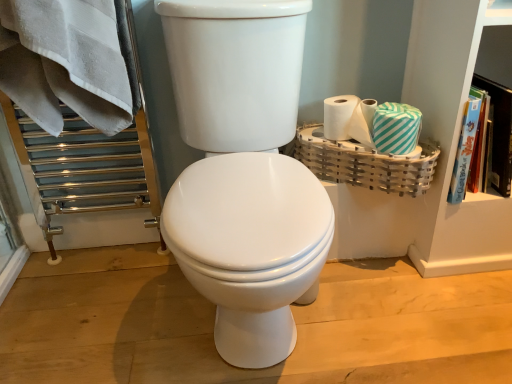
What do you see at coordinates (244, 171) in the screenshot? I see `white glossy toilet at center` at bounding box center [244, 171].

Describe the element at coordinates (470, 147) in the screenshot. The width and height of the screenshot is (512, 384). I see `hardcover book at upper right` at that location.

The height and width of the screenshot is (384, 512). Find the location of `green striped toilet paper at right`. green striped toilet paper at right is located at coordinates (359, 128).

The width and height of the screenshot is (512, 384). Identify the location of teal striped tissue at right. 396,128.

Locate an element on the screen. The width and height of the screenshot is (512, 384). white glossy toilet at center is located at coordinates (244, 171).

Does white glossy toilet at center have a larger size compared to bamboo basket at right?

Yes.

Choose the correct answer: Is white glossy toilet at center inside bamboo basket at right or outside it?

white glossy toilet at center exists outside the volume of bamboo basket at right.

Considering the points (234, 18) and (335, 153), which point is behind, point (234, 18) or point (335, 153)?

The point (335, 153) is more distant.

Considering the positions of objects white glossy toilet at center and bamboo basket at right in the image provided, who is more to the left, white glossy toilet at center or bamboo basket at right?

white glossy toilet at center is more to the left.

Which is farther from the camera, (464, 127) or (338, 167)?

The point (338, 167) is farther.

Where is `book behind the bamboo basket at right`? book behind the bamboo basket at right is located at coordinates (470, 147).

Who is taller, hardcover book at upper right or bamboo basket at right?

hardcover book at upper right.

How different are the orientations of green striped toilet paper at right and white glossy toilet at center in degrees?

The angular difference between green striped toilet paper at right and white glossy toilet at center is 1.43 degrees.

Is point (364, 134) in front of point (252, 73)?

No, it is behind (252, 73).

Visually, is green striped toilet paper at right positioned to the left or to the right of white glossy toilet at center?

Clearly, green striped toilet paper at right is on the right of white glossy toilet at center in the image.

Is the position of green striped toilet paper at right more distant than that of hardcover book at upper right?

Yes, the depth of green striped toilet paper at right is greater than that of hardcover book at upper right.

Can you tell me how much green striped toilet paper at right and hardcover book at upper right differ in facing direction?

The angular difference between green striped toilet paper at right and hardcover book at upper right is 2.66 degrees.

Considering the sizes of objects green striped toilet paper at right and hardcover book at upper right in the image provided, who is bigger, green striped toilet paper at right or hardcover book at upper right?

hardcover book at upper right is bigger.

From the image's perspective, does green striped toilet paper at right appear higher than hardcover book at upper right?

Yes, from the image's perspective, green striped toilet paper at right is above hardcover book at upper right.

From the image's perspective, is green striped toilet paper at right below teal striped tissue at right?

No, from the image's perspective, green striped toilet paper at right is not beneath teal striped tissue at right.

The width and height of the screenshot is (512, 384). In order to click on toilet paper on the left of teal striped tissue at right in this screenshot , I will do `click(359, 128)`.

Who is bigger, green striped toilet paper at right or teal striped tissue at right?

Bigger between the two is teal striped tissue at right.

Is green striped toilet paper at right not close to teal striped tissue at right?

No, green striped toilet paper at right is not far away from teal striped tissue at right.

Considering the points (378, 149) and (338, 145), which point is behind, point (378, 149) or point (338, 145)?

Point (338, 145)

Is teal striped tissue at right far away from bamboo basket at right?

No, there isn't a large distance between teal striped tissue at right and bamboo basket at right.

Considering the sizes of objects teal striped tissue at right and bamboo basket at right in the image provided, who is smaller, teal striped tissue at right or bamboo basket at right?

With smaller size is teal striped tissue at right.

From the image's perspective, between bamboo basket at right and teal striped tissue at right, who is located below?

bamboo basket at right.

From a real-world perspective, is bamboo basket at right positioned over teal striped tissue at right based on gravity?

Incorrect, from a real-world perspective, bamboo basket at right is lower than teal striped tissue at right.

Is bamboo basket at right far away from teal striped tissue at right?

No, bamboo basket at right is not far away from teal striped tissue at right.

Considering the sizes of objects bamboo basket at right and teal striped tissue at right in the image provided, who is wider, bamboo basket at right or teal striped tissue at right?

bamboo basket at right.

Locate an element on the screen. The image size is (512, 384). toilet in front of the bamboo basket at right is located at coordinates [x=244, y=171].

Locate an element on the screen. This screenshot has width=512, height=384. book above the bamboo basket at right (from a real-world perspective) is located at coordinates (470, 147).

Considering their positions, is teal striped tissue at right positioned further to bamboo basket at right than white glossy toilet at center?

white glossy toilet at center lies further to bamboo basket at right than the other object.

Considering their positions, is hardcover book at upper right positioned closer to teal striped tissue at right than green striped toilet paper at right?

green striped toilet paper at right is closer to teal striped tissue at right.

Estimate the real-world distances between objects in this image. Which object is further from green striped toilet paper at right, hardcover book at upper right or white glossy toilet at center?

Based on the image, white glossy toilet at center appears to be further to green striped toilet paper at right.

Which object lies nearer to the anchor point green striped toilet paper at right, teal striped tissue at right or hardcover book at upper right?

teal striped tissue at right lies closer to green striped toilet paper at right than the other object.

Looking at this image, when comparing their distances from bamboo basket at right, does green striped toilet paper at right or teal striped tissue at right seem further?

green striped toilet paper at right is further to bamboo basket at right.

Which object lies nearer to the anchor point white glossy toilet at center, teal striped tissue at right or bamboo basket at right?

bamboo basket at right is positioned closer to the anchor white glossy toilet at center.

Looking at the image, which one is located closer to hardcover book at upper right, white glossy toilet at center or teal striped tissue at right?

teal striped tissue at right is positioned closer to the anchor hardcover book at upper right.

From the image, which object appears to be nearer to teal striped tissue at right, bamboo basket at right or white glossy toilet at center?

bamboo basket at right lies closer to teal striped tissue at right than the other object.

Locate an element on the screen. The height and width of the screenshot is (384, 512). book positioned between white glossy toilet at center and teal striped tissue at right from near to far is located at coordinates (470, 147).

Image resolution: width=512 pixels, height=384 pixels. I want to click on basket between white glossy toilet at center and teal striped tissue at right along the z-axis, so click(365, 163).

Where is `toilet paper located between bamboo basket at right and hardcover book at upper right in the left-right direction`? toilet paper located between bamboo basket at right and hardcover book at upper right in the left-right direction is located at coordinates [x=359, y=128].

Locate an element on the screen. This screenshot has width=512, height=384. material between white glossy toilet at center and green striped toilet paper at right in the front-back direction is located at coordinates (396, 128).